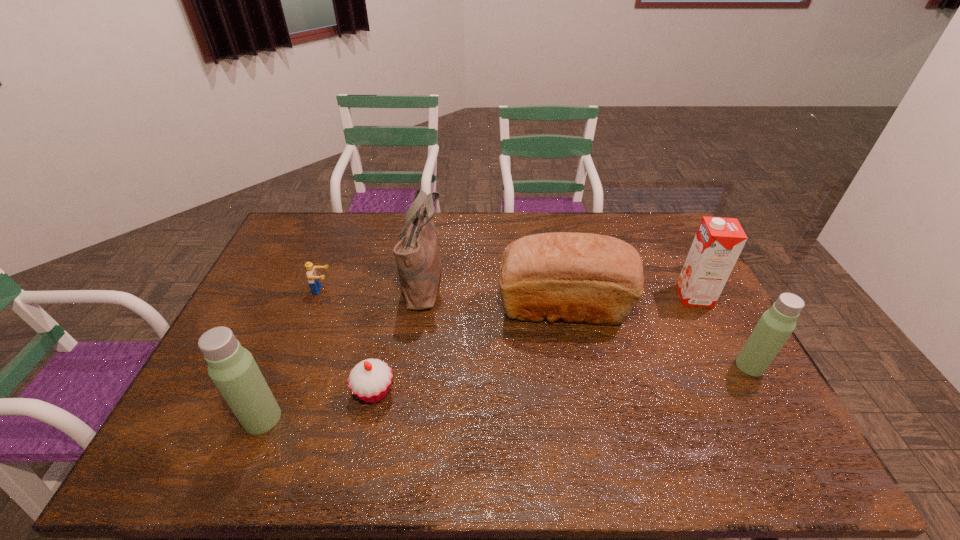
I want to click on empty location between the shorter thermos bottle and the taller thermos bottle, so click(x=506, y=392).

Find the location of a particular element. The height and width of the screenshot is (540, 960). unoccupied area between the cupcake and the Lego is located at coordinates (348, 341).

Where is `vacant area that lies between the left thermos bottle and the Lego`? The height and width of the screenshot is (540, 960). vacant area that lies between the left thermos bottle and the Lego is located at coordinates (293, 354).

Locate an element on the screen. vacant space in between the Lego and the left thermos bottle is located at coordinates (293, 354).

I want to click on free space between the Lego and the cupcake, so click(x=348, y=341).

Select which object appears as the third closest to the left thermos bottle. Please provide its 2D coordinates. Your answer should be formatted as a tuple, i.e. [(x, y)], where the tuple contains the x and y coordinates of a point satisfying the conditions above.

[(417, 258)]

Identify which object is the fifth nearest to the left thermos bottle. Please provide its 2D coordinates. Your answer should be formatted as a tuple, i.e. [(x, y)], where the tuple contains the x and y coordinates of a point satisfying the conditions above.

[(719, 241)]

Locate an element on the screen. free space that satisfies the following two spatial constraints: 1. on the back side of the carton; 2. on the left side of the bread is located at coordinates (561, 296).

What are the coordinates of `free space that satisfies the following two spatial constraints: 1. on the back side of the cupcake; 2. on the face of the Lego` in the screenshot? It's located at (395, 290).

Identify the location of free spot that satisfies the following two spatial constraints: 1. on the back side of the cupcake; 2. on the right side of the bread. (392, 308).